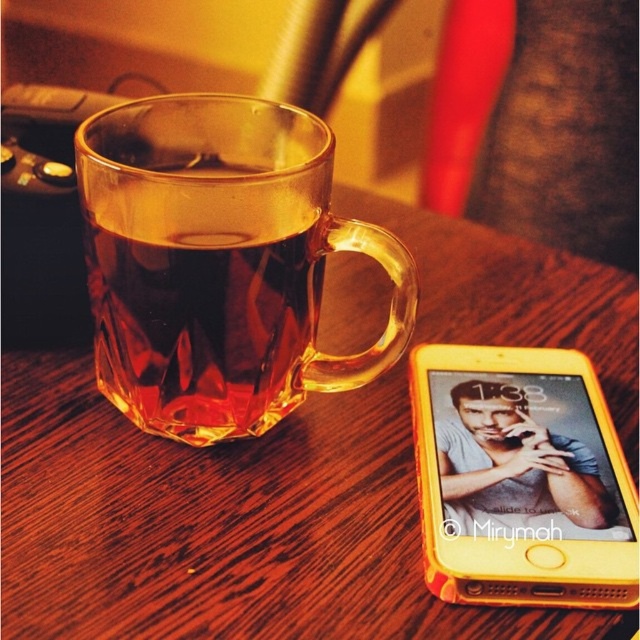
Between point (65, 486) and point (192, 321), which one is positioned behind?

The point (65, 486) is behind.

Can you confirm if wooden table at center is shorter than transparent glass mug at left?

No.

Which is behind, point (380, 400) or point (285, 289)?

The point (380, 400) is more distant.

Find the location of a particular element. Image resolution: width=640 pixels, height=640 pixels. wooden table at center is located at coordinates (225, 524).

Which is more to the left, wooden table at center or yellow plastic smartphone at right?

Positioned to the left is wooden table at center.

Does point (243, 529) lie behind point (560, 484)?

No, it is not.

Find the location of a particular element. The width and height of the screenshot is (640, 640). wooden table at center is located at coordinates (225, 524).

Which is behind, point (156, 154) or point (512, 464)?

Positioned behind is point (156, 154).

The image size is (640, 640). Describe the element at coordinates (220, 262) in the screenshot. I see `transparent glass mug at left` at that location.

Is point (243, 358) positioned behind point (593, 458)?

No.

Where is `transparent glass mug at left`? The width and height of the screenshot is (640, 640). transparent glass mug at left is located at coordinates coord(220,262).